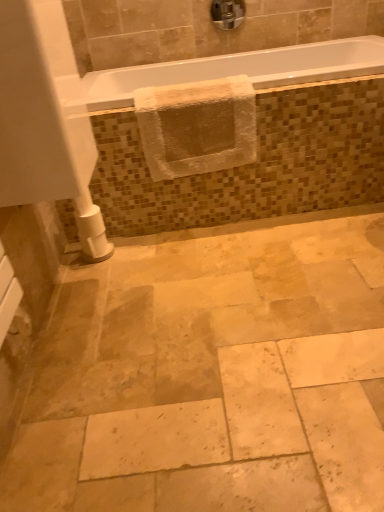
What do you see at coordinates (240, 70) in the screenshot? The height and width of the screenshot is (512, 384). I see `white glossy bathtub at upper center` at bounding box center [240, 70].

In order to face chrome metallic faucet at upper center, should I rotate leftwards or rightwards?

A 5.192 degree turn to the right will do.

This screenshot has height=512, width=384. What do you see at coordinates (197, 126) in the screenshot?
I see `white textured towel at upper center` at bounding box center [197, 126].

This screenshot has height=512, width=384. I want to click on white glossy bathtub at upper center, so click(x=240, y=70).

Is the position of white glossy bathtub at upper center less distant than that of chrome metallic faucet at upper center?

Yes, white glossy bathtub at upper center is in front of chrome metallic faucet at upper center.

From the image's perspective, which one is positioned higher, white glossy bathtub at upper center or chrome metallic faucet at upper center?

From the image's view, chrome metallic faucet at upper center is above.

Image resolution: width=384 pixels, height=512 pixels. Find the location of `faucet behind the white glossy bathtub at upper center`. faucet behind the white glossy bathtub at upper center is located at coordinates (227, 13).

How distant is white glossy bathtub at upper center from chrome metallic faucet at upper center?

They are 22.11 inches apart.

Between white textured towel at upper center and chrome metallic faucet at upper center, which one appears on the right side from the viewer's perspective?

chrome metallic faucet at upper center is more to the right.

I want to click on bath towel that appears on the left of chrome metallic faucet at upper center, so click(x=197, y=126).

Considering the relative sizes of white textured towel at upper center and chrome metallic faucet at upper center in the image provided, is white textured towel at upper center bigger than chrome metallic faucet at upper center?

Indeed, white textured towel at upper center has a larger size compared to chrome metallic faucet at upper center.

In the scene shown: Can you confirm if white textured towel at upper center is thinner than chrome metallic faucet at upper center?

In fact, white textured towel at upper center might be wider than chrome metallic faucet at upper center.

Which point is more forward, (163, 131) or (269, 318)?

The point (269, 318) is more forward.

Considering the positions of objects white textured towel at upper center and natural stone tile at center in the image provided, who is more to the right, white textured towel at upper center or natural stone tile at center?

Positioned to the right is natural stone tile at center.

Is white textured towel at upper center oriented away from natural stone tile at center?

No, white textured towel at upper center is not facing the opposite direction of natural stone tile at center.

Are white textured towel at upper center and natural stone tile at center far apart?

white textured towel at upper center is actually quite close to natural stone tile at center.

How much distance is there between white textured towel at upper center and white glossy bathtub at upper center?

The distance of white textured towel at upper center from white glossy bathtub at upper center is 12.50 inches.

You are a GUI agent. You are given a task and a screenshot of the screen. Output one action in this format:
    pyautogui.click(x=<x>, y=<y>)
    Task: Click on the bathtub above the white textured towel at upper center (from a real-world perspective)
    This screenshot has height=512, width=384.
    Given the screenshot: What is the action you would take?
    pyautogui.click(x=240, y=70)

What's the angular difference between white textured towel at upper center and white glossy bathtub at upper center's facing directions?

They differ by 0.438 degrees in their facing directions.

From a real-world perspective, who is located lower, white textured towel at upper center or white glossy bathtub at upper center?

white textured towel at upper center, from a real-world perspective.

Is natural stone tile at center not inside chrome metallic faucet at upper center?

natural stone tile at center is positioned outside chrome metallic faucet at upper center.

Which of these two, natural stone tile at center or chrome metallic faucet at upper center, is smaller?

chrome metallic faucet at upper center is smaller.

How many degrees apart are the facing directions of white glossy bathtub at upper center and white textured towel at upper center?

0.438 degrees.

Measure the distance between white glossy bathtub at upper center and white textured towel at upper center.

white glossy bathtub at upper center and white textured towel at upper center are 12.50 inches apart from each other.

From the image's perspective, is white glossy bathtub at upper center located above or below white textured towel at upper center?

Based on their image positions, white glossy bathtub at upper center is located above white textured towel at upper center.

Is white glossy bathtub at upper center turned away from white textured towel at upper center?

white glossy bathtub at upper center is not turned away from white textured towel at upper center.

How many degrees apart are the facing directions of chrome metallic faucet at upper center and white glossy bathtub at upper center?

1.71 degrees separate the facing orientations of chrome metallic faucet at upper center and white glossy bathtub at upper center.

Choose the correct answer: Is chrome metallic faucet at upper center inside white glossy bathtub at upper center or outside it?

chrome metallic faucet at upper center is located beyond the bounds of white glossy bathtub at upper center.

How far apart are chrome metallic faucet at upper center and white glossy bathtub at upper center?

The distance of chrome metallic faucet at upper center from white glossy bathtub at upper center is 22.11 inches.

I want to click on bathtub located underneath the chrome metallic faucet at upper center (from a real-world perspective), so click(x=240, y=70).

Locate an element on the screen. Image resolution: width=384 pixels, height=512 pixels. bathtub directly beneath the chrome metallic faucet at upper center (from a real-world perspective) is located at coordinates (240, 70).

Locate an element on the screen. The image size is (384, 512). faucet that appears above the white textured towel at upper center (from a real-world perspective) is located at coordinates (227, 13).

Which object lies further to the anchor point white glossy bathtub at upper center, white textured towel at upper center or natural stone tile at center?

Among the two, natural stone tile at center is located further to white glossy bathtub at upper center.

Considering their positions, is natural stone tile at center positioned further to white glossy bathtub at upper center than white textured towel at upper center?

natural stone tile at center lies further to white glossy bathtub at upper center than the other object.

From the image, which object appears to be nearer to natural stone tile at center, white textured towel at upper center or chrome metallic faucet at upper center?

Based on the image, white textured towel at upper center appears to be nearer to natural stone tile at center.

Based on their spatial positions, is white glossy bathtub at upper center or natural stone tile at center closer to chrome metallic faucet at upper center?

Based on the image, white glossy bathtub at upper center appears to be nearer to chrome metallic faucet at upper center.

Estimate the real-world distances between objects in this image. Which object is closer to natural stone tile at center, white textured towel at upper center or white glossy bathtub at upper center?

The object closer to natural stone tile at center is white textured towel at upper center.

Looking at the image, which one is located closer to white textured towel at upper center, chrome metallic faucet at upper center or natural stone tile at center?

Based on the image, natural stone tile at center appears to be nearer to white textured towel at upper center.

Estimate the real-world distances between objects in this image. Which object is further from natural stone tile at center, chrome metallic faucet at upper center or white textured towel at upper center?

chrome metallic faucet at upper center is further to natural stone tile at center.

Consider the image. When comparing their distances from white textured towel at upper center, does natural stone tile at center or white glossy bathtub at upper center seem closer?

The object closer to white textured towel at upper center is white glossy bathtub at upper center.

You are a GUI agent. You are given a task and a screenshot of the screen. Output one action in this format:
    pyautogui.click(x=<x>, y=<y>)
    Task: Click on the bathtub between chrome metallic faucet at upper center and natural stone tile at center vertically
    The width and height of the screenshot is (384, 512).
    Given the screenshot: What is the action you would take?
    pyautogui.click(x=240, y=70)

This screenshot has width=384, height=512. I want to click on bathtub between chrome metallic faucet at upper center and white textured towel at upper center from top to bottom, so [240, 70].

Locate an element on the screen. The height and width of the screenshot is (512, 384). bath towel between white glossy bathtub at upper center and natural stone tile at center in the vertical direction is located at coordinates (197, 126).

At what (x,y) coordinates should I click in order to perform the action: click on bath towel between chrome metallic faucet at upper center and natural stone tile at center vertically. Please return your answer as a coordinate pair (x, y). Looking at the image, I should click on (197, 126).